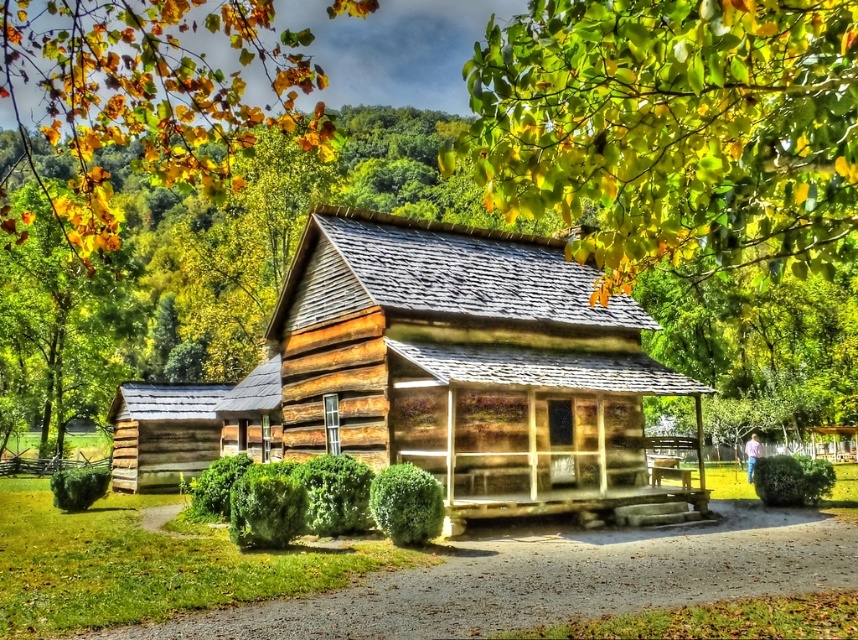
Question: Can you confirm if yellow-green leaves at upper center is smaller than wooden log cabin at center?

Choices:
 (A) no
 (B) yes

Answer: (A)

Question: Can you confirm if yellow-green leaves at upper center is positioned below wooden log cabin at center?

Choices:
 (A) no
 (B) yes

Answer: (A)

Question: Which object is farther from the camera taking this photo?

Choices:
 (A) yellow-green leaves at upper center
 (B) wooden log cabin at center

Answer: (B)

Question: Where is yellow-green leaves at upper center located in relation to wooden log cabin at center in the image?

Choices:
 (A) left
 (B) right

Answer: (B)